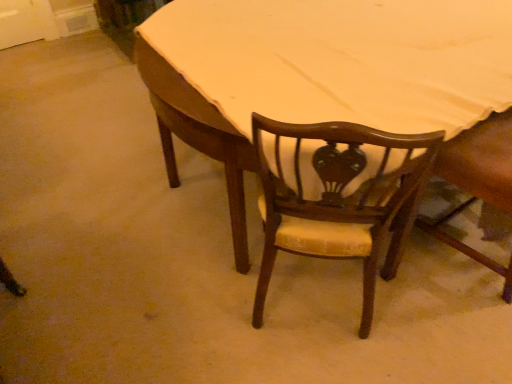
Question: Would you say wooden chair at center, the first chair viewed from the right, is to the left or to the right of wooden chair at center, positioned as the 1th chair in left-to-right order, in the picture?

Choices:
 (A) left
 (B) right

Answer: (B)

Question: Does point pos(461,175) appear closer or farther from the camera than point pos(302,248)?

Choices:
 (A) farther
 (B) closer

Answer: (A)

Question: Based on their relative distances, which object is farther from the wooden chair at center, marked as the 2th chair in a left-to-right arrangement?

Choices:
 (A) wooden chair at center, which is the second chair from right to left
 (B) wooden table at center

Answer: (B)

Question: Considering the real-world distances, which object is closest to the wooden chair at center, positioned as the 1th chair in left-to-right order?

Choices:
 (A) wooden table at center
 (B) wooden chair at center, the first chair viewed from the right

Answer: (A)